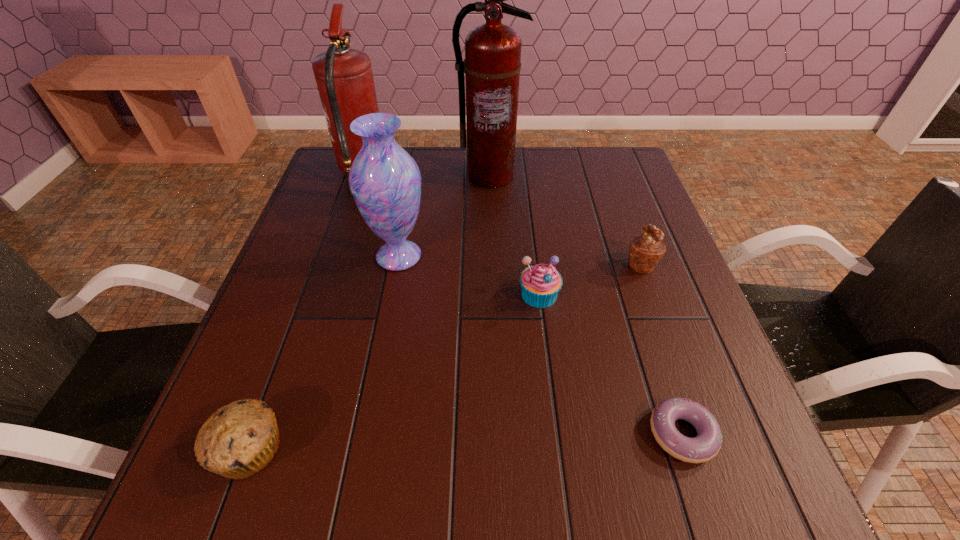
The height and width of the screenshot is (540, 960). Identify the location of the right fire extinguisher. (492, 64).

At what (x,y) coordinates should I click in order to perform the action: click on the left fire extinguisher. Please return your answer as a coordinate pair (x, y). Looking at the image, I should click on (344, 77).

Locate an element on the screen. Image resolution: width=960 pixels, height=540 pixels. vase is located at coordinates (385, 181).

You are a GUI agent. You are given a task and a screenshot of the screen. Output one action in this format:
    pyautogui.click(x=<x>, y=<y>)
    Task: Click on the third object from left to right
    The image size is (960, 540).
    Given the screenshot: What is the action you would take?
    pyautogui.click(x=385, y=181)

Where is `the farthest muffin`? Image resolution: width=960 pixels, height=540 pixels. the farthest muffin is located at coordinates (646, 250).

Where is `the fifth farthest object`? the fifth farthest object is located at coordinates (540, 283).

The width and height of the screenshot is (960, 540). Identify the location of the second nearest muffin. (540, 283).

Where is `the nearest muffin`? the nearest muffin is located at coordinates (238, 440).

Image resolution: width=960 pixels, height=540 pixels. I want to click on doughnut, so click(x=707, y=443).

Locate an element on the screen. The width and height of the screenshot is (960, 540). vacant space located 0.150m on the nozzle side of the right fire extinguisher is located at coordinates (491, 224).